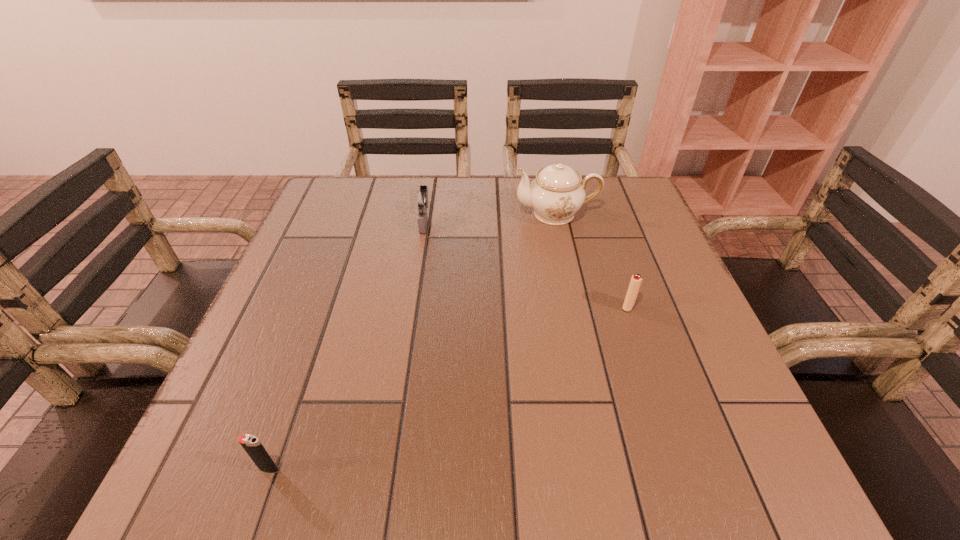
Locate an element on the screen. free spot between the nearest igniter and the second farthest igniter is located at coordinates (448, 388).

This screenshot has height=540, width=960. I want to click on free point between the rightmost igniter and the farthest igniter, so click(x=526, y=264).

Locate an element on the screen. vacant space that's between the rightmost igniter and the third shortest object is located at coordinates (526, 264).

Find the location of a particular element. This screenshot has height=540, width=960. blank region between the tallest igniter and the tallest object is located at coordinates click(x=491, y=218).

Find the location of a particular element. The height and width of the screenshot is (540, 960). vacant area that lies between the chinaware and the third object from right to left is located at coordinates (491, 218).

What are the coordinates of `empty space that is in between the second nearest igniter and the tallest igniter` in the screenshot? It's located at (526, 264).

Where is `unoccupied area between the chinaware and the second nearest igniter`? unoccupied area between the chinaware and the second nearest igniter is located at coordinates (592, 260).

Where is `object that is the third closest one to the second tallest object`? object that is the third closest one to the second tallest object is located at coordinates (251, 444).

I want to click on object that is the third closest to the nearest igniter, so click(556, 194).

Image resolution: width=960 pixels, height=540 pixels. What are the coordinates of `igniter that stands as the second closest to the rightmost igniter` in the screenshot? It's located at (251, 444).